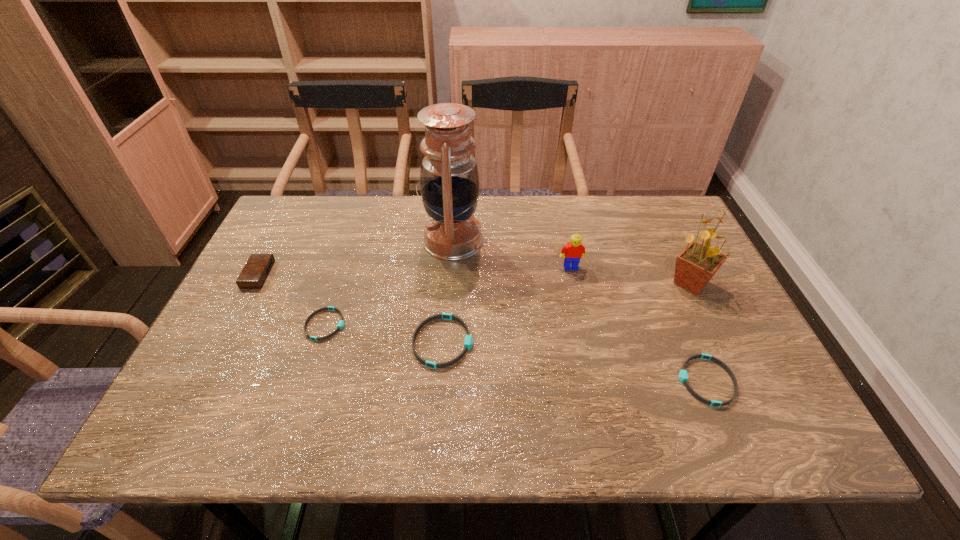
Locate an element on the screen. the leftmost object is located at coordinates (256, 270).

Where is `alarm clock`? The image size is (960, 540). alarm clock is located at coordinates (256, 270).

This screenshot has width=960, height=540. I want to click on free space located on the buckle of the sixth object from right to left, so click(387, 325).

You are a GUI agent. You are given a task and a screenshot of the screen. Output one action in this format:
    pyautogui.click(x=<x>, y=<y>)
    Task: Click on the vacant space located on the buckle of the tallest wristband
    
    Given the screenshot: What is the action you would take?
    pyautogui.click(x=504, y=342)

This screenshot has width=960, height=540. I want to click on free space located 0.080m on the buckle of the second shortest object, so click(641, 381).

Where is `vacant space positioned on the buckle of the second shortest object`? vacant space positioned on the buckle of the second shortest object is located at coordinates (572, 381).

Image resolution: width=960 pixels, height=540 pixels. In order to click on free space located 0.070m on the buckle of the second shortest object in this screenshot , I will do `click(646, 381)`.

This screenshot has height=540, width=960. In order to click on vacant space located on the right of the oil lamp in this screenshot , I will do `click(524, 241)`.

Identify the location of vacant space located 0.050m at the front of the sunflower with flowers visible. The width and height of the screenshot is (960, 540). (647, 284).

Locate an element on the screen. The width and height of the screenshot is (960, 540). vacant space located 0.080m at the front of the sunflower with flowers visible is located at coordinates (636, 284).